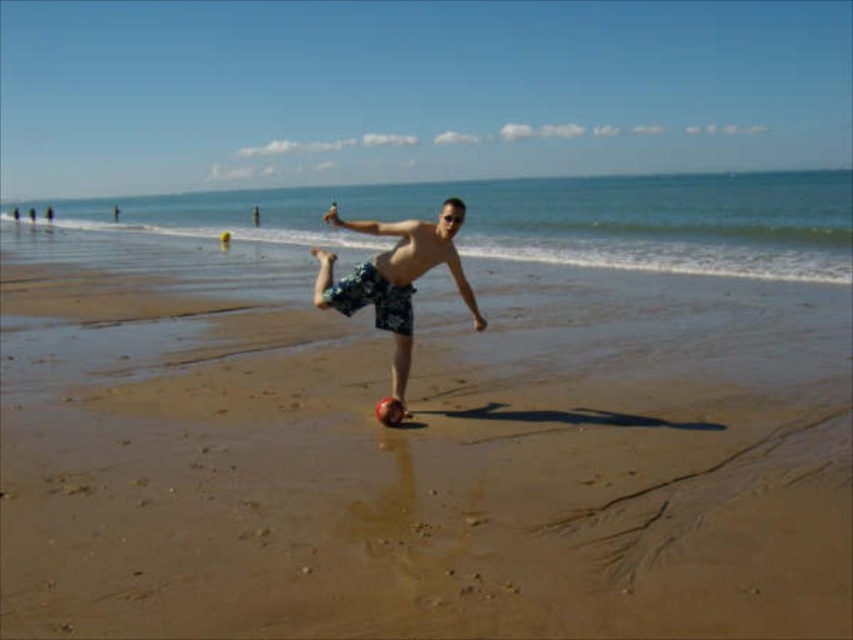
You are a photographer trying to capture the perfect shot of the man playing soccer on the beach. According to the scene description, where exactly should you position your camera to focus on the floral shorts at center?

The floral shorts at center are located at the 2D coordinates point (395, 276), so you should position your camera to focus on that point to capture the floral shorts at center.